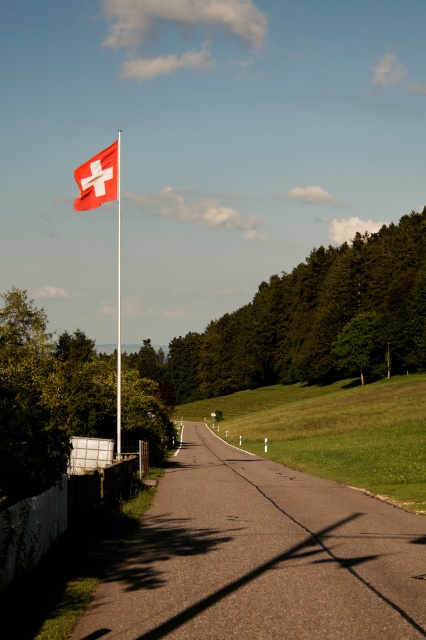
Question: Does asphalt road at center have a lesser width compared to red plastic flag pole at upper left?

Choices:
 (A) no
 (B) yes

Answer: (B)

Question: Is asphalt road at center positioned at the back of red plastic flag pole at upper left?

Choices:
 (A) no
 (B) yes

Answer: (A)

Question: Among these points, which one is nearest to the camera?

Choices:
 (A) (118, 224)
 (B) (85, 196)

Answer: (B)

Question: Which object appears closest to the camera in this image?

Choices:
 (A) asphalt road at center
 (B) red fabric flag at upper left

Answer: (A)

Question: Is red fabric flag at upper left positioned in front of red plastic flag pole at upper left?

Choices:
 (A) yes
 (B) no

Answer: (B)

Question: Which of these objects is positioned closest to the red fabric flag at upper left?

Choices:
 (A) red plastic flag pole at upper left
 (B) asphalt road at center

Answer: (A)